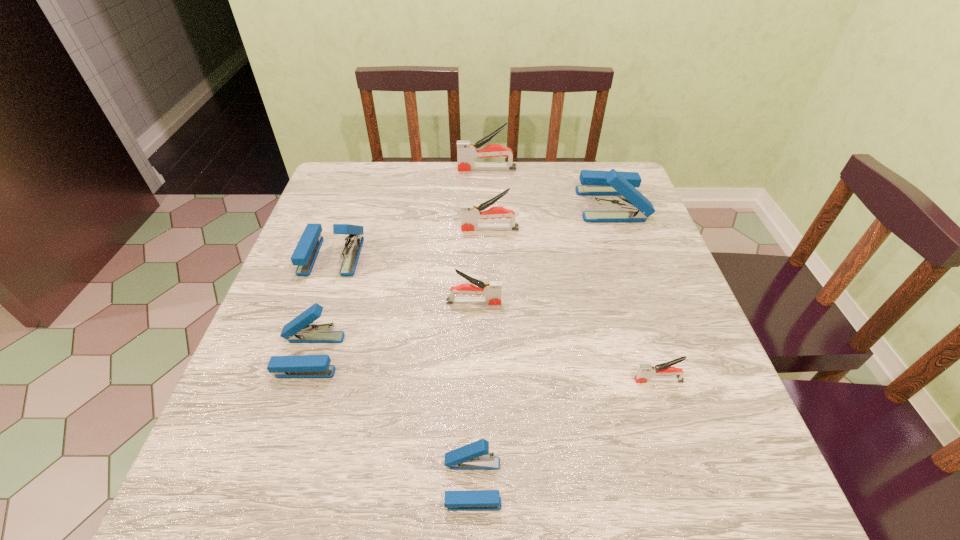
At what (x,y) coordinates should I click in order to perform the action: click on the farthest gray stapler. Please return your answer as a coordinate pair (x, y). Image resolution: width=960 pixels, height=540 pixels. Looking at the image, I should click on pos(466,152).

At what (x,y) coordinates should I click in order to perform the action: click on the farthest object. Please return your answer as a coordinate pair (x, y). This screenshot has height=540, width=960. Looking at the image, I should click on (466, 152).

Where is `the seventh nearest stapler`? the seventh nearest stapler is located at coordinates (594, 183).

The width and height of the screenshot is (960, 540). I want to click on the farthest blue stapler, so click(594, 183).

This screenshot has width=960, height=540. Identify the location of the third smallest gray stapler. (470, 213).

The image size is (960, 540). What are the coordinates of `the sixth nearest object` in the screenshot? It's located at 470,213.

Identify the location of the fifth nearest stapler. (304, 256).

This screenshot has width=960, height=540. Identify the location of the third smallest blue stapler. (304, 256).

Locate an element on the screen. The width and height of the screenshot is (960, 540). the fourth nearest stapler is located at coordinates pos(492,290).

Locate an element on the screen. This screenshot has height=540, width=960. the third farthest gray stapler is located at coordinates (492, 290).